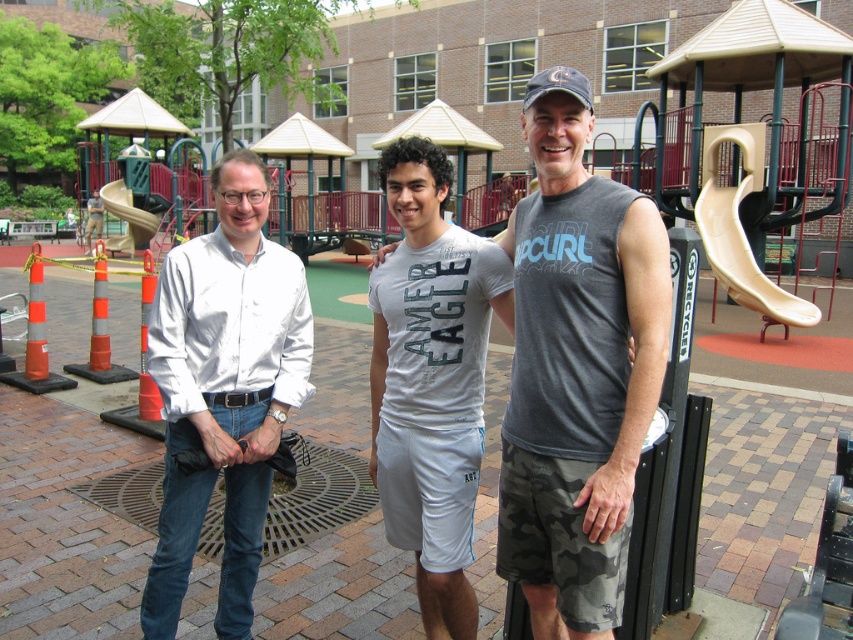
Where is the gray sleeveless shirt at center located in the image?

The gray sleeveless shirt at center is located at the 2D coordinates point (577, 369) in the image.